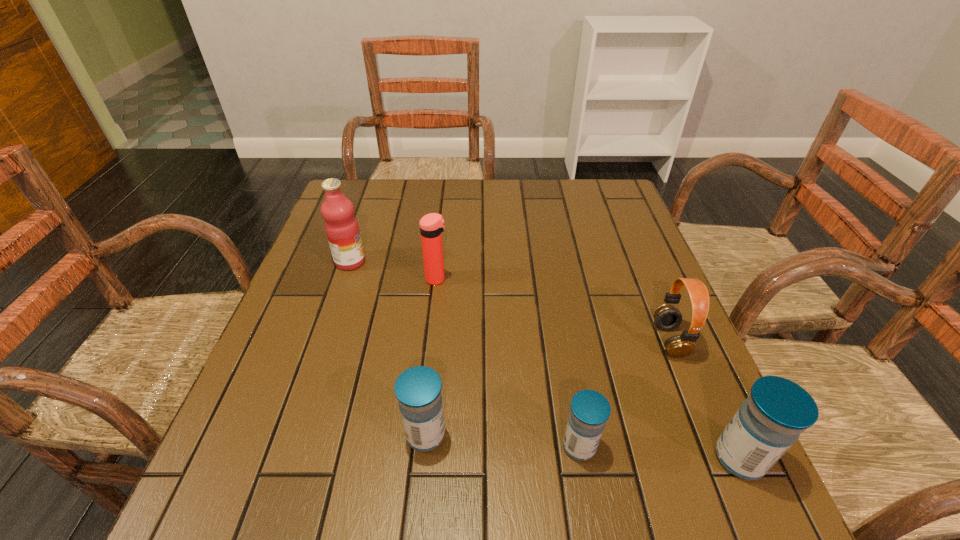
The width and height of the screenshot is (960, 540). Find the location of `vacant area that lies between the rightmost medicine and the fourth object from left to right`. vacant area that lies between the rightmost medicine and the fourth object from left to right is located at coordinates (660, 452).

I want to click on vacant area that lies between the fifth nearest object and the second medicine from left to right, so [x=508, y=362].

This screenshot has height=540, width=960. In order to click on vacant area between the fourth nearest object and the fruit juice in this screenshot , I will do `click(510, 301)`.

At what (x,y) coordinates should I click in order to perform the action: click on empty space between the headset and the thermos bottle. Please return your answer as a coordinate pair (x, y). Looking at the image, I should click on (553, 309).

Find the location of a particular element. This screenshot has width=960, height=540. free spot between the thermos bottle and the third farthest object is located at coordinates (553, 309).

Locate which object ranks fifth in proximity to the second tallest medicine. Please provide its 2D coordinates. Your answer should be formatted as a tuple, i.e. [(x, y)], where the tuple contains the x and y coordinates of a point satisfying the conditions above.

[(777, 410)]

The height and width of the screenshot is (540, 960). Find the location of `object that is the fifth closest to the leftmost medicine`. object that is the fifth closest to the leftmost medicine is located at coordinates (777, 410).

Locate which medicine is the second closest to the third farthest object. Please provide its 2D coordinates. Your answer should be formatted as a tuple, i.e. [(x, y)], where the tuple contains the x and y coordinates of a point satisfying the conditions above.

[(590, 410)]

You are a GUI agent. You are given a task and a screenshot of the screen. Output one action in this format:
    pyautogui.click(x=<x>, y=<y>)
    Task: Click on the medicine that can be found as the second closest to the headset
    This screenshot has height=540, width=960.
    Given the screenshot: What is the action you would take?
    pyautogui.click(x=590, y=410)

Where is `blank space that satisfies the following two spatial constraints: 1. on the front side of the second shortest medicine; 2. on the right side of the rightmost medicine`? This screenshot has width=960, height=540. blank space that satisfies the following two spatial constraints: 1. on the front side of the second shortest medicine; 2. on the right side of the rightmost medicine is located at coordinates (423, 458).